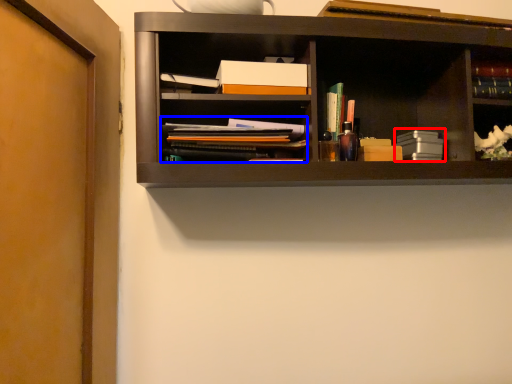
Question: Which object is closer to the camera taking this photo, book (highlighted by a red box) or book (highlighted by a blue box)?

Choices:
 (A) book
 (B) book

Answer: (B)